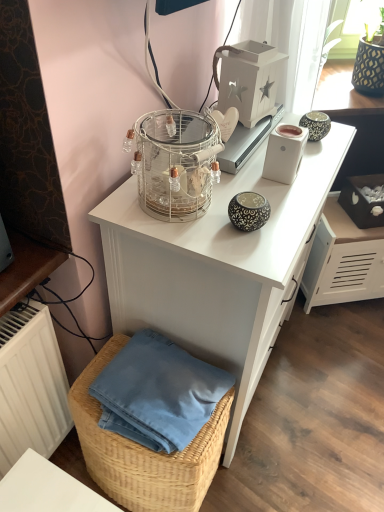
Question: Is woven straw basket at lower left not near white glossy desk at upper center?

Choices:
 (A) yes
 (B) no

Answer: (B)

Question: Are woven straw basket at lower left and white glossy desk at upper center beside each other?

Choices:
 (A) yes
 (B) no

Answer: (B)

Question: Is woven straw basket at lower left behind white glossy desk at upper center?

Choices:
 (A) yes
 (B) no

Answer: (A)

Question: Is woven straw basket at lower left turned away from white glossy desk at upper center?

Choices:
 (A) no
 (B) yes

Answer: (A)

Question: Can we say woven straw basket at lower left lies outside white glossy desk at upper center?

Choices:
 (A) yes
 (B) no

Answer: (A)

Question: Considering the positions of white wooden lantern at upper center, acting as the first appliance starting from the top, and clear glass birdcage at upper center in the image, is white wooden lantern at upper center, acting as the first appliance starting from the top, taller or shorter than clear glass birdcage at upper center?

Choices:
 (A) short
 (B) tall

Answer: (B)

Question: Considering the positions of white wooden lantern at upper center, acting as the first appliance starting from the top, and clear glass birdcage at upper center in the image, is white wooden lantern at upper center, acting as the first appliance starting from the top, bigger or smaller than clear glass birdcage at upper center?

Choices:
 (A) big
 (B) small

Answer: (B)

Question: Which is correct: white wooden lantern at upper center, which is the 2th appliance from bottom to top, is inside clear glass birdcage at upper center, or outside of it?

Choices:
 (A) inside
 (B) outside

Answer: (B)

Question: Considering their positions, is white wooden lantern at upper center, which is the 2th appliance from bottom to top, located in front of or behind clear glass birdcage at upper center?

Choices:
 (A) behind
 (B) front

Answer: (A)

Question: Looking at the image, does woven straw basket at lower left seem bigger or smaller compared to clear glass birdcage at upper center?

Choices:
 (A) big
 (B) small

Answer: (A)

Question: From a real-world perspective, is woven straw basket at lower left above or below clear glass birdcage at upper center?

Choices:
 (A) below
 (B) above

Answer: (A)

Question: Looking at their shapes, would you say woven straw basket at lower left is wider or thinner than clear glass birdcage at upper center?

Choices:
 (A) thin
 (B) wide

Answer: (B)

Question: Visually, is woven straw basket at lower left positioned to the left or to the right of clear glass birdcage at upper center?

Choices:
 (A) left
 (B) right

Answer: (A)

Question: Considering the positions of woven straw basket at lower left and white wooden lantern at upper center, which is the 2th appliance from bottom to top, in the image, is woven straw basket at lower left bigger or smaller than white wooden lantern at upper center, which is the 2th appliance from bottom to top,?

Choices:
 (A) big
 (B) small

Answer: (A)

Question: Do you think woven straw basket at lower left is within white wooden lantern at upper center, which is the 2th appliance from bottom to top, or outside of it?

Choices:
 (A) inside
 (B) outside

Answer: (B)